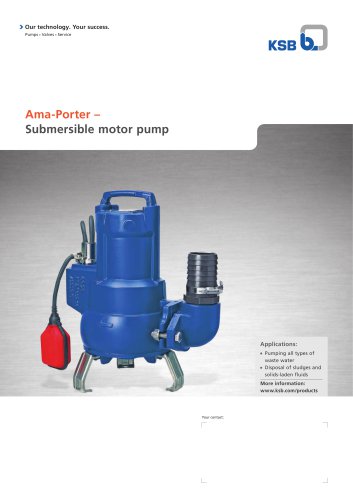
Locate an element on the screen. This screenshot has height=500, width=353. handle is located at coordinates pyautogui.click(x=127, y=194).